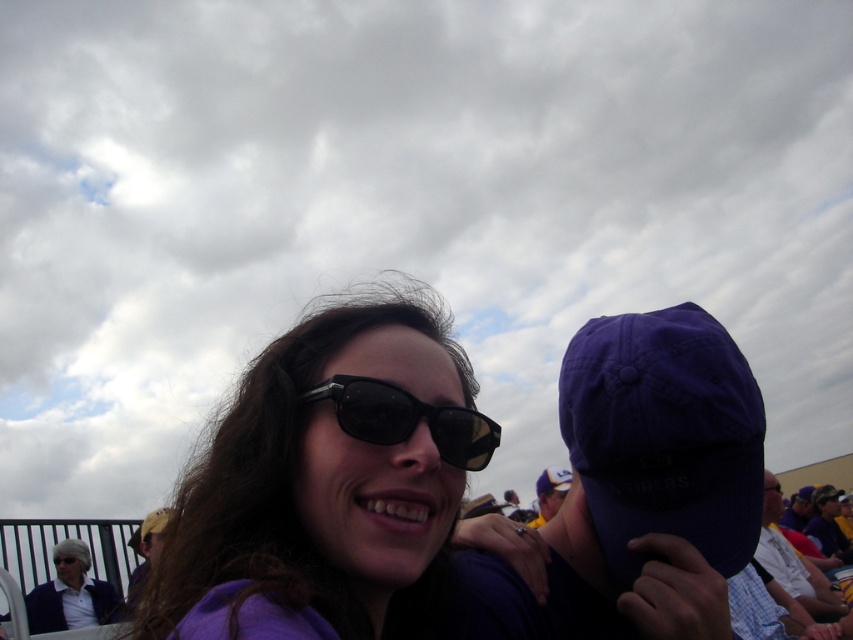
Which is more to the left, purple fabric cap at center or black plastic sunglasses at center?

From the viewer's perspective, black plastic sunglasses at center appears more on the left side.

Who is positioned more to the right, purple fabric cap at center or black plastic sunglasses at center?

purple fabric cap at center is more to the right.

Measure the distance between point (624, 435) and camera.

1.24 meters

Locate an element on the screen. The image size is (853, 640). purple fabric cap at center is located at coordinates (659, 444).

Is point (335, 593) less distant than point (61, 563)?

Yes, it is.

Between point (277, 477) and point (56, 564), which one is positioned in front?

Point (277, 477)

Image resolution: width=853 pixels, height=640 pixels. Identify the location of purple matte sunglasses at center. (274, 474).

Can you confirm if purple fabric cap at center is taller than matte blue jacket at lower left?

In fact, purple fabric cap at center may be shorter than matte blue jacket at lower left.

Is the position of purple fabric cap at center more distant than that of matte blue jacket at lower left?

No.

Identify the location of purple fabric cap at center. This screenshot has width=853, height=640. (659, 444).